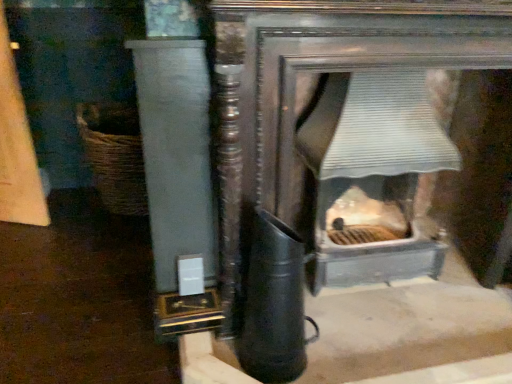
Question: Considering the positions of white glossy pillar at left and metallic gray fireplace at center in the image, is white glossy pillar at left bigger or smaller than metallic gray fireplace at center?

Choices:
 (A) big
 (B) small

Answer: (B)

Question: Is point (147, 162) positioned closer to the camera than point (408, 254)?

Choices:
 (A) closer
 (B) farther

Answer: (A)

Question: Considering the real-world distances, which object is closest to the metallic gray fireplace at center?

Choices:
 (A) white glossy pillar at left
 (B) woven brown basket at left

Answer: (A)

Question: Based on their relative distances, which object is farther from the white glossy pillar at left?

Choices:
 (A) metallic gray fireplace at center
 (B) woven brown basket at left

Answer: (B)